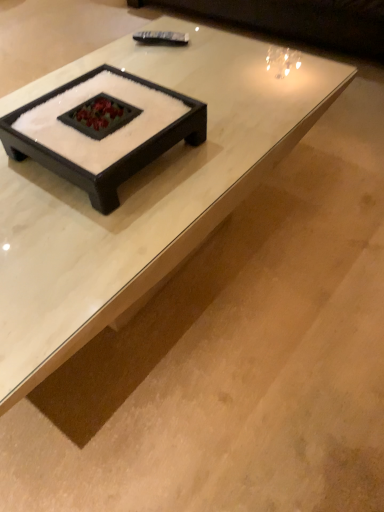
Question: Considering the relative sizes of white glossy coffee table at center and dark brown leather couch at upper center in the image provided, is white glossy coffee table at center smaller than dark brown leather couch at upper center?

Choices:
 (A) no
 (B) yes

Answer: (B)

Question: Is white glossy coffee table at center shorter than dark brown leather couch at upper center?

Choices:
 (A) no
 (B) yes

Answer: (A)

Question: Is white glossy coffee table at center placed right next to dark brown leather couch at upper center?

Choices:
 (A) no
 (B) yes

Answer: (A)

Question: Considering the relative positions of white glossy coffee table at center and dark brown leather couch at upper center in the image provided, is white glossy coffee table at center behind dark brown leather couch at upper center?

Choices:
 (A) yes
 (B) no

Answer: (B)

Question: Is white glossy coffee table at center thinner than dark brown leather couch at upper center?

Choices:
 (A) no
 (B) yes

Answer: (B)

Question: Does white glossy coffee table at center have a larger size compared to dark brown leather couch at upper center?

Choices:
 (A) yes
 (B) no

Answer: (B)

Question: Does dark brown leather couch at upper center have a smaller size compared to white glossy coffee table at center?

Choices:
 (A) yes
 (B) no

Answer: (B)

Question: Could you tell me if dark brown leather couch at upper center is turned towards white glossy coffee table at center?

Choices:
 (A) no
 (B) yes

Answer: (B)

Question: From the image's perspective, is dark brown leather couch at upper center located beneath white glossy coffee table at center?

Choices:
 (A) no
 (B) yes

Answer: (A)

Question: Is white glossy coffee table at center at the back of dark brown leather couch at upper center?

Choices:
 (A) no
 (B) yes

Answer: (A)

Question: Is dark brown leather couch at upper center far away from white glossy coffee table at center?

Choices:
 (A) yes
 (B) no

Answer: (A)

Question: Is dark brown leather couch at upper center completely or partially outside of white glossy coffee table at center?

Choices:
 (A) yes
 (B) no

Answer: (A)

Question: From a real-world perspective, is dark brown leather couch at upper center physically located above or below white glossy coffee table at center?

Choices:
 (A) above
 (B) below

Answer: (B)